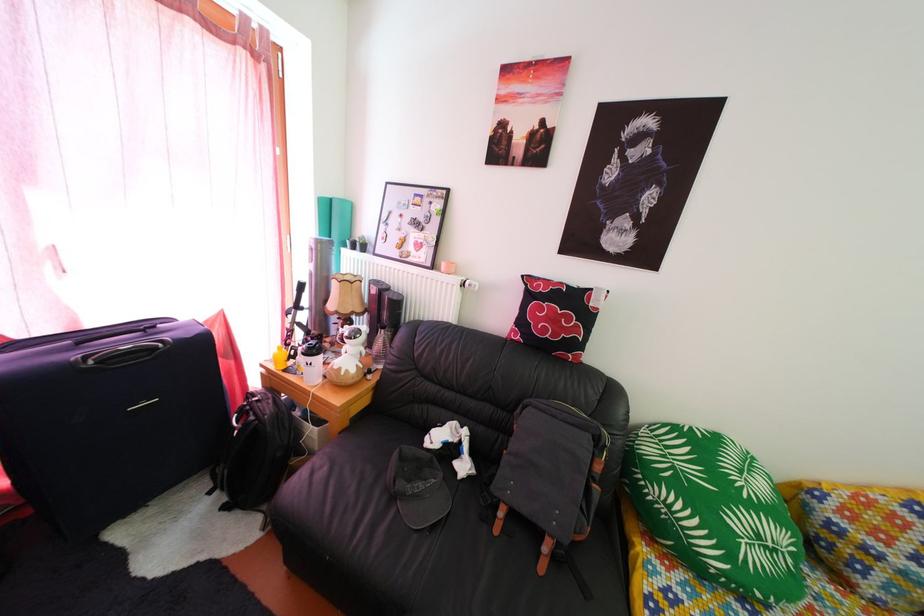
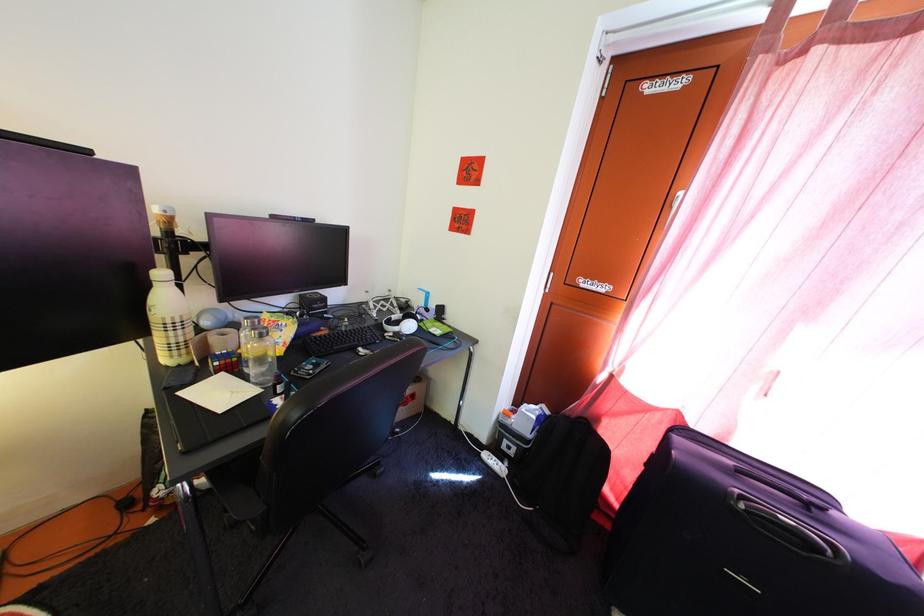
Question: The camera is either moving clockwise (left) or counter-clockwise (right) around the object. The first image is from the beginning of the video and the second image is from the end. Is the camera moving left or right when shooting the video?

Choices:
 (A) Left
 (B) Right

Answer: (B)